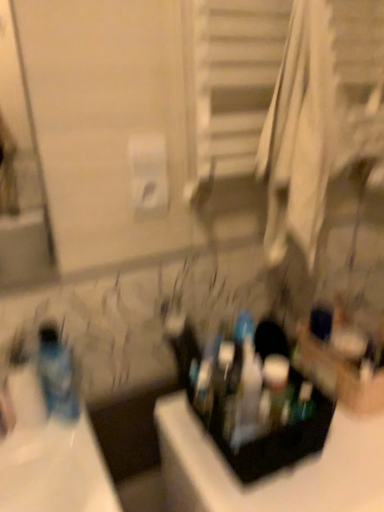
Question: Does translucent plastic bottle at left have a greater height compared to black plastic container at center?

Choices:
 (A) yes
 (B) no

Answer: (B)

Question: Can we say translucent plastic bottle at left lies outside black plastic container at center?

Choices:
 (A) yes
 (B) no

Answer: (A)

Question: From a real-world perspective, is translucent plastic bottle at left positioned under black plastic container at center based on gravity?

Choices:
 (A) no
 (B) yes

Answer: (A)

Question: From a real-world perspective, is translucent plastic bottle at left located higher than black plastic container at center?

Choices:
 (A) no
 (B) yes

Answer: (B)

Question: From the image's perspective, would you say translucent plastic bottle at left is positioned over black plastic container at center?

Choices:
 (A) no
 (B) yes

Answer: (B)

Question: Based on their positions, is translucent plastic bottle at left located to the left or right of black plastic container at center?

Choices:
 (A) left
 (B) right

Answer: (A)

Question: From a real-world perspective, relative to black plastic container at center, is translucent plastic bottle at left vertically above or below?

Choices:
 (A) above
 (B) below

Answer: (A)

Question: From their relative heights in the image, would you say translucent plastic bottle at left is taller or shorter than black plastic container at center?

Choices:
 (A) short
 (B) tall

Answer: (A)

Question: From the image's perspective, relative to black plastic container at center, is translucent plastic bottle at left above or below?

Choices:
 (A) below
 (B) above

Answer: (B)

Question: Relative to black plastic container at center, is white matte toilet paper at upper center in front or behind?

Choices:
 (A) front
 (B) behind

Answer: (B)

Question: Is white matte toilet paper at upper center to the left or to the right of black plastic container at center in the image?

Choices:
 (A) left
 (B) right

Answer: (A)

Question: From a real-world perspective, is white matte toilet paper at upper center physically located above or below black plastic container at center?

Choices:
 (A) below
 (B) above

Answer: (B)

Question: Choose the correct answer: Is white matte toilet paper at upper center inside black plastic container at center or outside it?

Choices:
 (A) inside
 (B) outside

Answer: (B)

Question: Considering the relative positions of translucent plastic mouthwash at center and black plastic container at center in the image provided, is translucent plastic mouthwash at center to the left or to the right of black plastic container at center?

Choices:
 (A) right
 (B) left

Answer: (B)

Question: In the image, is translucent plastic mouthwash at center positioned in front of or behind black plastic container at center?

Choices:
 (A) front
 (B) behind

Answer: (B)